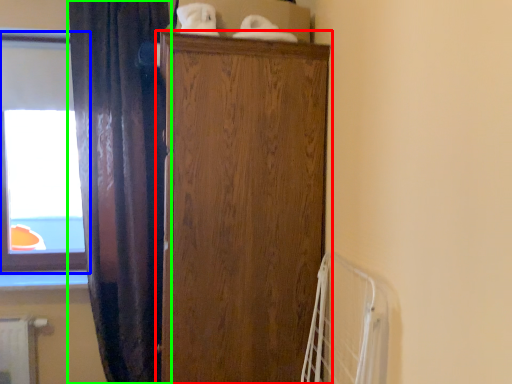
Question: Based on their relative distances, which object is farther from cupboard (highlighted by a red box)? Choose from window (highlighted by a blue box) and curtain (highlighted by a green box).

Choices:
 (A) window
 (B) curtain

Answer: (A)